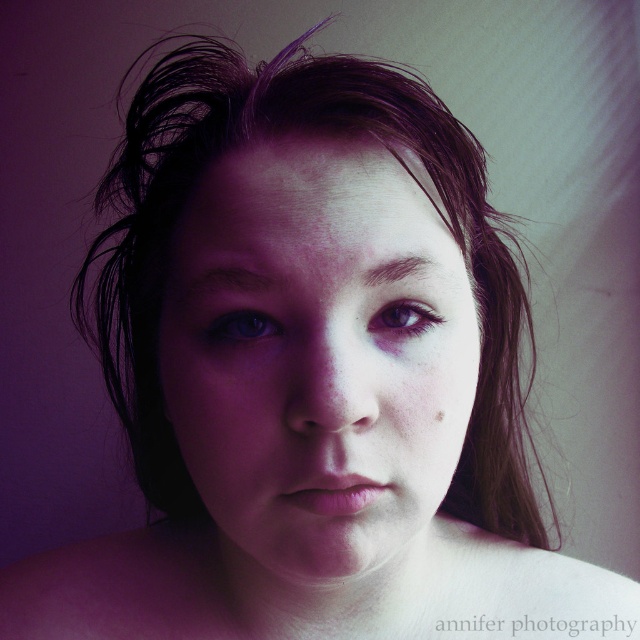
Does smooth skin face at center have a greater width compared to brown matte freckle at center?

Yes.

Does point (320, 444) lie in front of point (438, 410)?

Yes, it is.

You are a GUI agent. You are given a task and a screenshot of the screen. Output one action in this format:
    pyautogui.click(x=<x>, y=<y>)
    Task: Click on the smooth skin face at center
    Image resolution: width=640 pixels, height=640 pixels.
    Given the screenshot: What is the action you would take?
    pyautogui.click(x=316, y=356)

Is point (422, 230) positioned in front of point (374, 312)?

No, it is not.

Which is in front, point (464, 404) or point (413, 310)?

Positioned in front is point (413, 310).

This screenshot has width=640, height=640. Find the location of `smooth skin face at center`. smooth skin face at center is located at coordinates (316, 356).

Looking at this image, which is more to the left, blue glossy eye at center or purple matte eye at center?

From the viewer's perspective, blue glossy eye at center appears more on the left side.

Can you confirm if blue glossy eye at center is taller than purple matte eye at center?

No, blue glossy eye at center is not taller than purple matte eye at center.

Is point (227, 314) behind point (396, 307)?

No, it is not.

You are a GUI agent. You are given a task and a screenshot of the screen. Output one action in this format:
    pyautogui.click(x=<x>, y=<y>)
    Task: Click on the blue glossy eye at center
    
    Given the screenshot: What is the action you would take?
    pyautogui.click(x=241, y=326)